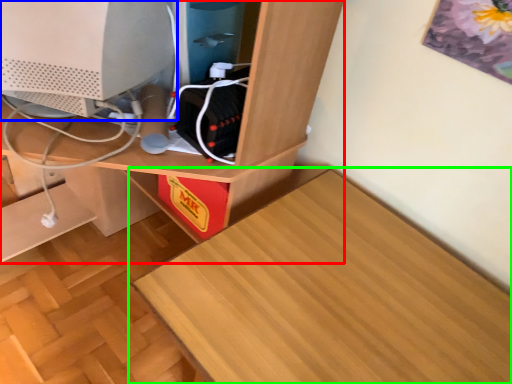
Question: Considering the real-world distances, which object is farthest from desk (highlighted by a red box)? computer monitor (highlighted by a blue box) or table (highlighted by a green box)?

Choices:
 (A) computer monitor
 (B) table

Answer: (B)